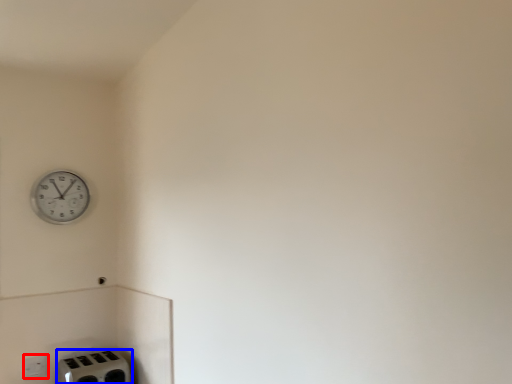
Question: Which of the following is the farthest to the observer, electric outlet (highlighted by a red box) or appliance (highlighted by a blue box)?

Choices:
 (A) electric outlet
 (B) appliance

Answer: (A)